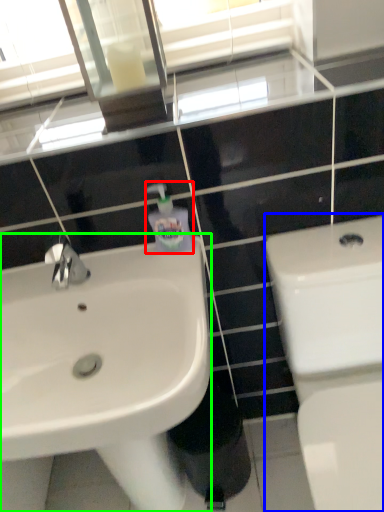
Question: Based on their relative distances, which object is farther from soap dispenser (highlighted by a red box)? Choose from toilet (highlighted by a blue box) and sink (highlighted by a green box).

Choices:
 (A) toilet
 (B) sink

Answer: (A)